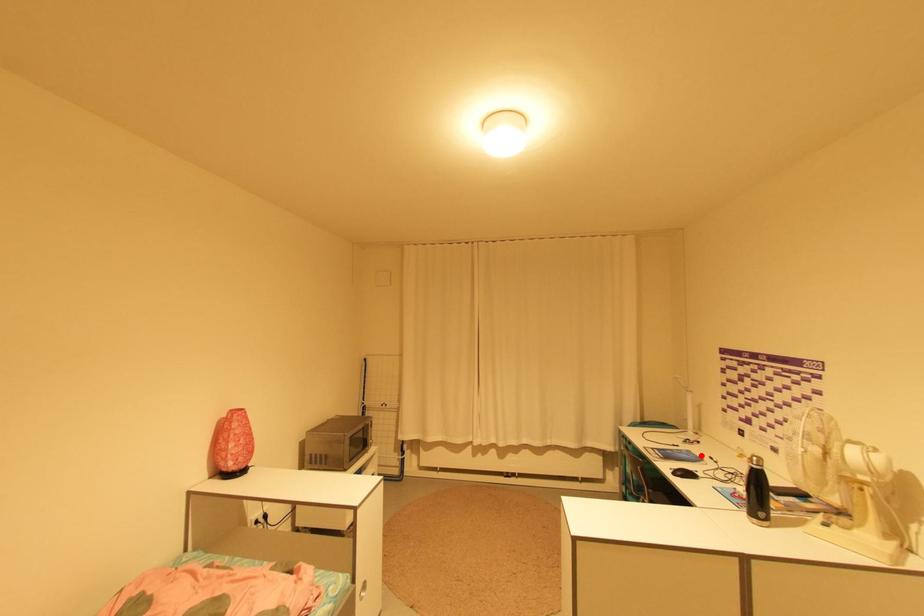
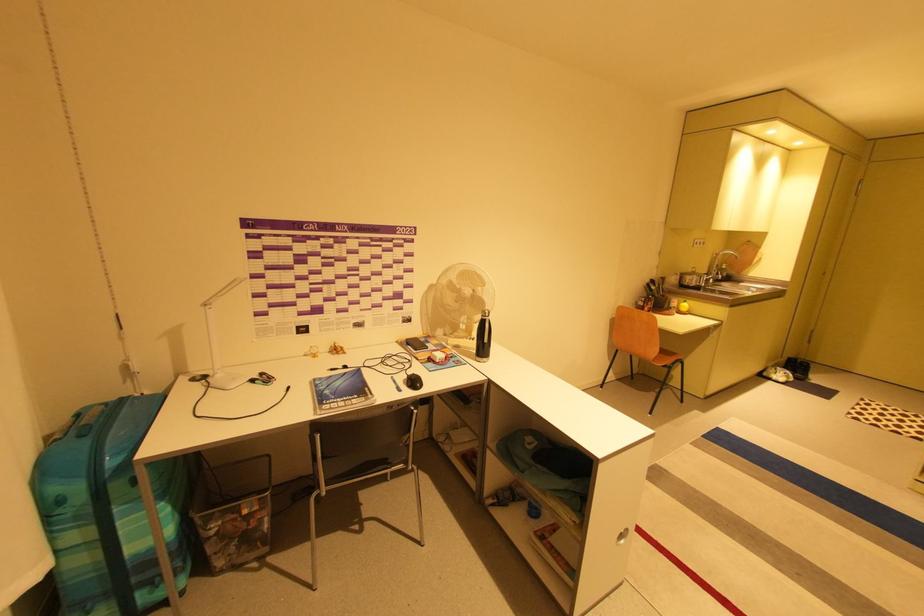
Find the pixel in the second image that matches the highlighted location in the first image.

(336, 377)